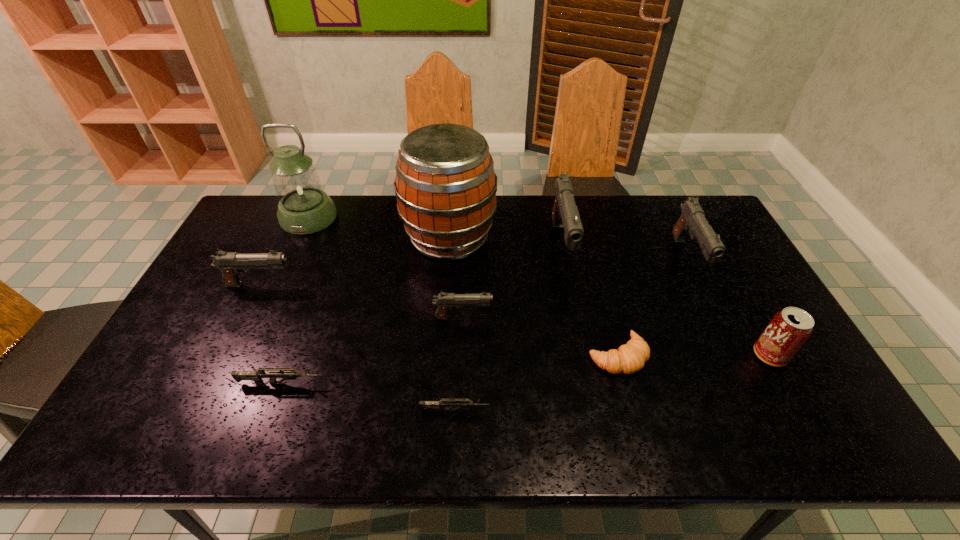
Locate an element on the screen. Image resolution: width=960 pixels, height=540 pixels. vacant space that is in between the lantern and the shortest object is located at coordinates (382, 314).

This screenshot has height=540, width=960. What are the coordinates of `vacant space that's between the soda can and the cider` in the screenshot? It's located at (610, 296).

In order to click on vacant area between the crescent roll and the second gun from right to left in this screenshot , I will do `click(589, 300)`.

The width and height of the screenshot is (960, 540). I want to click on free space between the crescent roll and the bigger grey gun, so click(x=449, y=369).

Where is `vacant area between the second nearest gun and the rightmost gun`? This screenshot has width=960, height=540. vacant area between the second nearest gun and the rightmost gun is located at coordinates (485, 320).

Find the location of `vacant area that lies between the nearest gray gun and the farther grey gun`. vacant area that lies between the nearest gray gun and the farther grey gun is located at coordinates (372, 350).

Where is `empty space that is in between the second nearest object and the third smallest gray gun`? This screenshot has height=540, width=960. empty space that is in between the second nearest object and the third smallest gray gun is located at coordinates (485, 320).

At what (x,y) coordinates should I click in order to perform the action: click on free area in between the cider and the soda can. Please return your answer as a coordinate pair (x, y). Looking at the image, I should click on (610, 296).

Locate an element on the screen. free space between the third smallest gray gun and the right grey gun is located at coordinates (571, 334).

Point out which object is positioned as the sixth nearest to the cider. Please provide its 2D coordinates. Your answer should be formatted as a tuple, i.e. [(x, y)], where the tuple contains the x and y coordinates of a point satisfying the conditions above.

[(256, 376)]